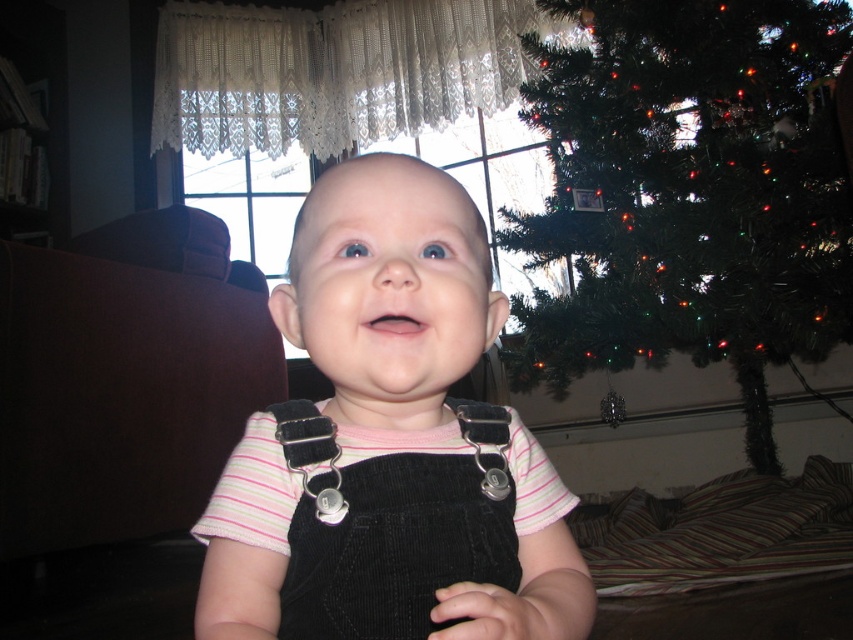
Question: Does black corduroy overalls at center have a smaller size compared to green artificial christmas tree at upper right?

Choices:
 (A) no
 (B) yes

Answer: (B)

Question: Which point is closer to the camera?

Choices:
 (A) (325, 524)
 (B) (375, 493)
 (C) (695, 48)

Answer: (A)

Question: Which point appears farthest from the camera in this image?

Choices:
 (A) (804, 163)
 (B) (428, 403)

Answer: (A)

Question: Considering the relative positions of black corduroy overalls at center and green artificial christmas tree at upper right in the image provided, where is black corduroy overalls at center located with respect to green artificial christmas tree at upper right?

Choices:
 (A) below
 (B) above

Answer: (A)

Question: Does black corduroy overalls at center appear under green artificial christmas tree at upper right?

Choices:
 (A) no
 (B) yes

Answer: (B)

Question: Which object appears closest to the camera in this image?

Choices:
 (A) black corduroy overalls at center
 (B) black corduroy suspenders at center

Answer: (A)